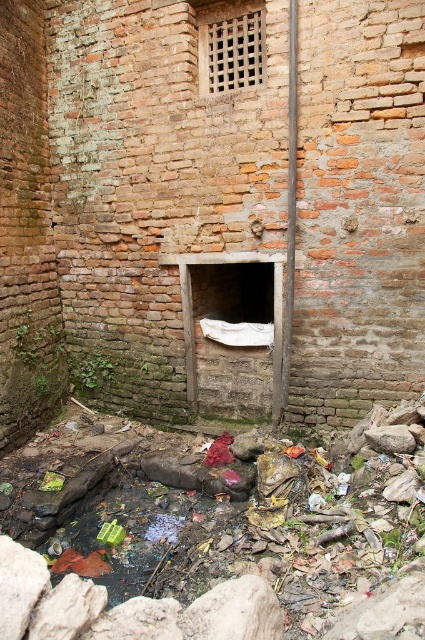
Does white paper at center appear on the right side of smooth metallic pole at center?

No, white paper at center is not to the right of smooth metallic pole at center.

Is white paper at center to the left of smooth metallic pole at center from the viewer's perspective?

Correct, you'll find white paper at center to the left of smooth metallic pole at center.

Is point (368, 156) farther from viewer compared to point (283, 326)?

No, (368, 156) is closer to viewer.

You are a GUI agent. You are given a task and a screenshot of the screen. Output one action in this format:
    pyautogui.click(x=<x>, y=<y>)
    Task: Click on the white paper at center
    The image size is (425, 640).
    Given the screenshot: What is the action you would take?
    (136, 209)

Consider the image. Can you confirm if white paper at center is wider than stone lattice window at center?

Indeed, white paper at center has a greater width compared to stone lattice window at center.

Which is above, white paper at center or stone lattice window at center?

stone lattice window at center is above.

I want to click on white paper at center, so click(136, 209).

This screenshot has height=640, width=425. Find the location of `white paper at center`. white paper at center is located at coordinates [136, 209].

Which is below, stone lattice window at center or smooth metallic pole at center?

Positioned lower is smooth metallic pole at center.

Between stone lattice window at center and smooth metallic pole at center, which one has less height?

With less height is stone lattice window at center.

Identify the location of stone lattice window at center. (231, 49).